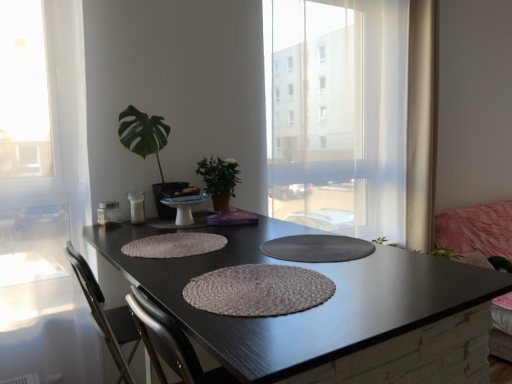
Image resolution: width=512 pixels, height=384 pixels. I want to click on free space in front of rustic woven placemat at center, which is the second wide in front-to-back order, so click(175, 265).